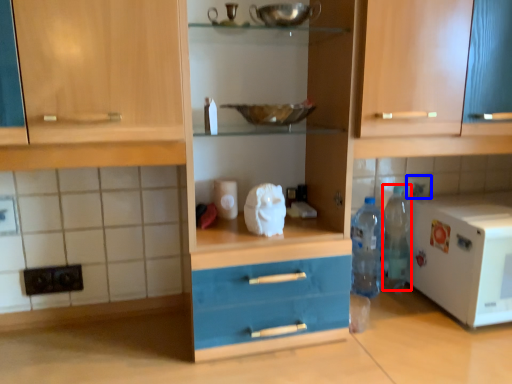
Question: Which object is closer to the camera taking this photo, bottle (highlighted by a red box) or tile (highlighted by a blue box)?

Choices:
 (A) bottle
 (B) tile

Answer: (A)